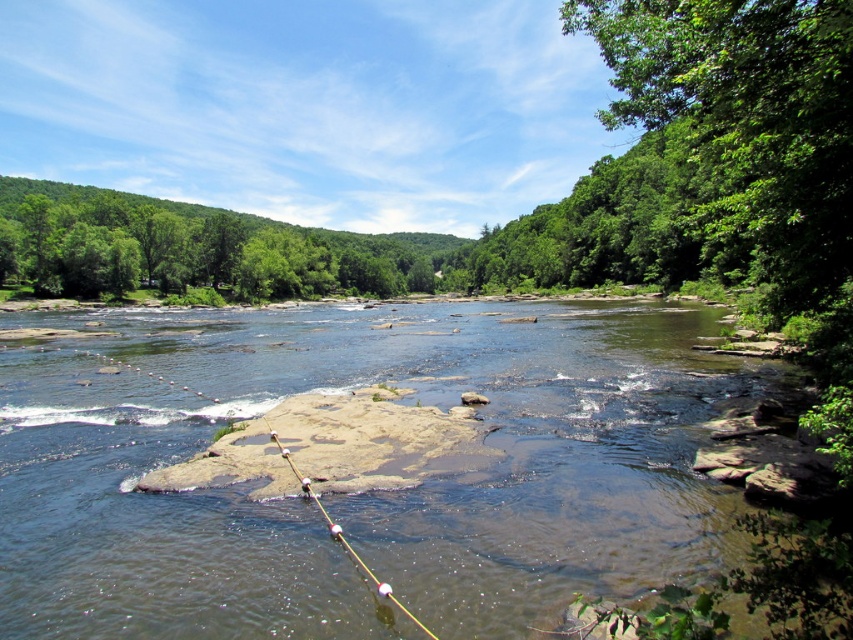
In the scene shown: You are a swimmer wanting to cross the river safely. The brown rocky stream at center is a submerged hazard, and the white plastic fishing pole at center marks a safe path. How far apart are these two landmarks?

The brown rocky stream at center and the white plastic fishing pole at center are 25.45 meters apart from each other, so the swimmer should be aware of the distance between these two landmarks to navigate safely.

You are standing at the riverbank and see the brown rocky stream at center and the white plastic fishing pole at center. Which object is taller?

The brown rocky stream at center is taller than the white plastic fishing pole at center.

You are standing at the edge of the river and see the point marked at coordinates (363, 493). What does this point indicate in the river landscape?

The point at coordinates (363, 493) corresponds to the brown rocky stream at center, indicating its central location in the river landscape.